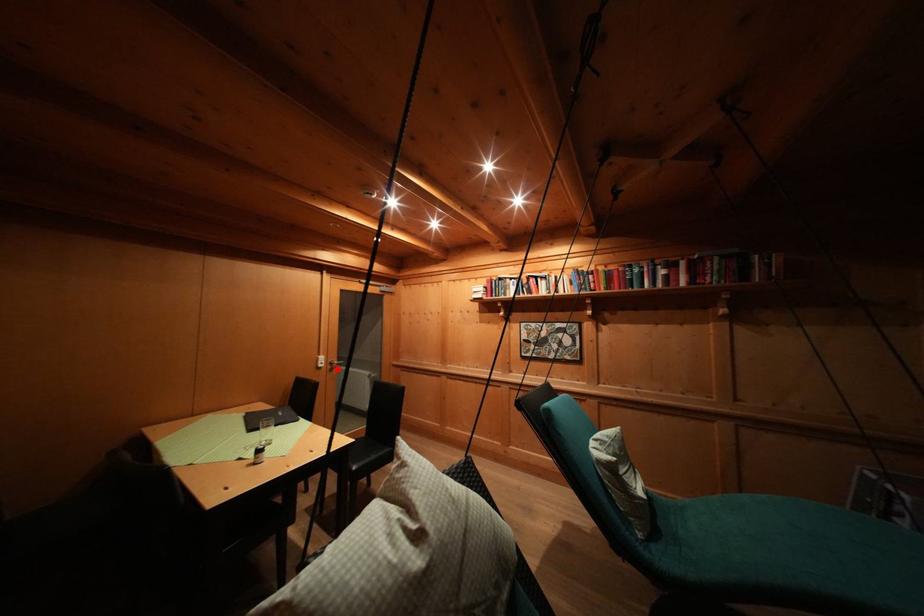
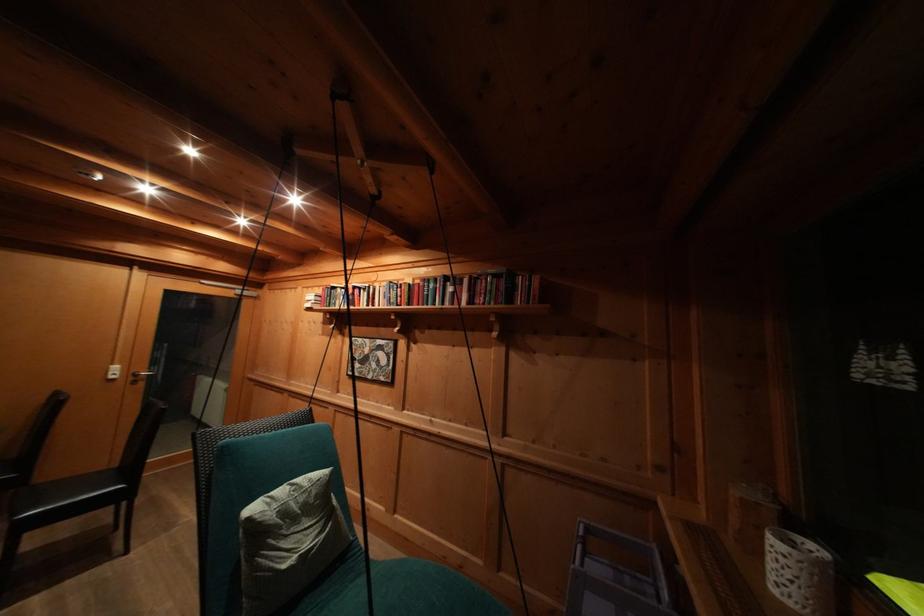
Locate, in the second image, the point that corresponds to the highlighted location in the first image.

(141, 379)